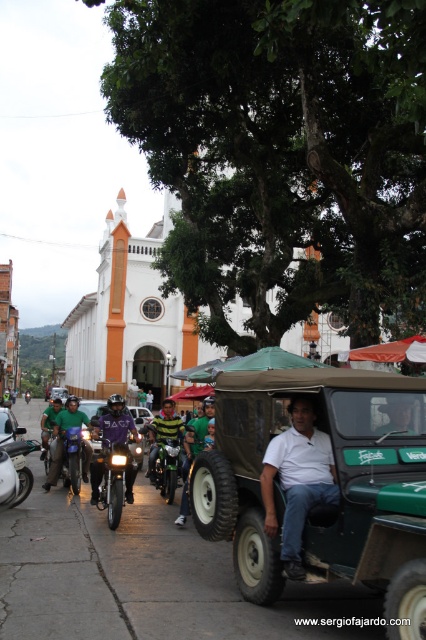
Is shiny chrome motorcycle at center thinner than green matte motorcycle at left?

Correct, shiny chrome motorcycle at center's width is less than green matte motorcycle at left's.

Does shiny chrome motorcycle at center appear over green matte motorcycle at left?

Correct, shiny chrome motorcycle at center is located above green matte motorcycle at left.

Is point (111, 522) positioned after point (58, 392)?

No.

Where is `shiny chrome motorcycle at center`? Image resolution: width=426 pixels, height=640 pixels. shiny chrome motorcycle at center is located at coordinates (112, 476).

Locate an element on the screen. This screenshot has width=426, height=640. shiny blue motorcycle at center is located at coordinates (71, 458).

Who is higher up, green matte jeep at center or metallic silver car at center?

green matte jeep at center

Describe the element at coordinates (337, 484) in the screenshot. I see `green matte jeep at center` at that location.

You are a GUI agent. You are given a task and a screenshot of the screen. Output one action in this format:
    pyautogui.click(x=<x>, y=<y>)
    Task: Click on the green matte jeep at center
    
    Given the screenshot: What is the action you would take?
    pyautogui.click(x=337, y=484)